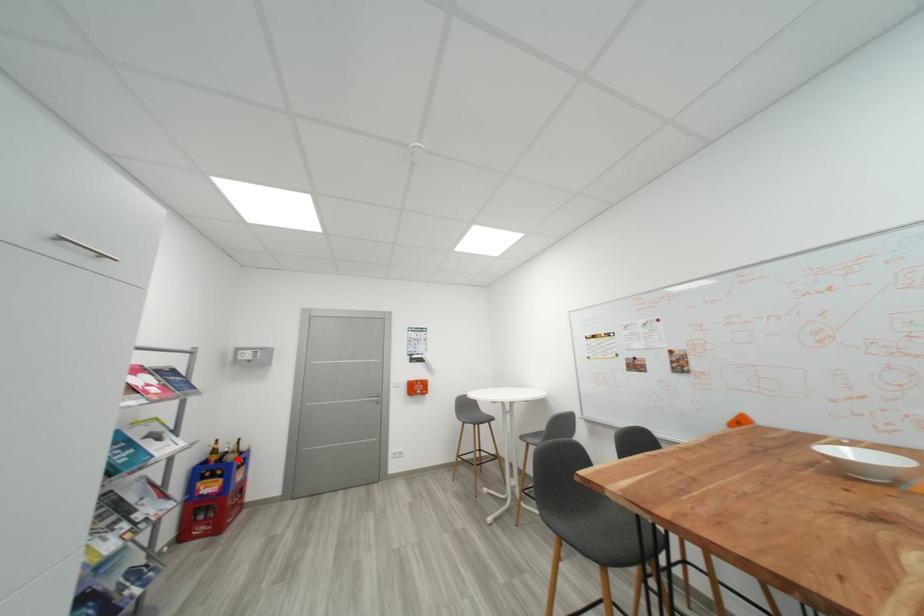
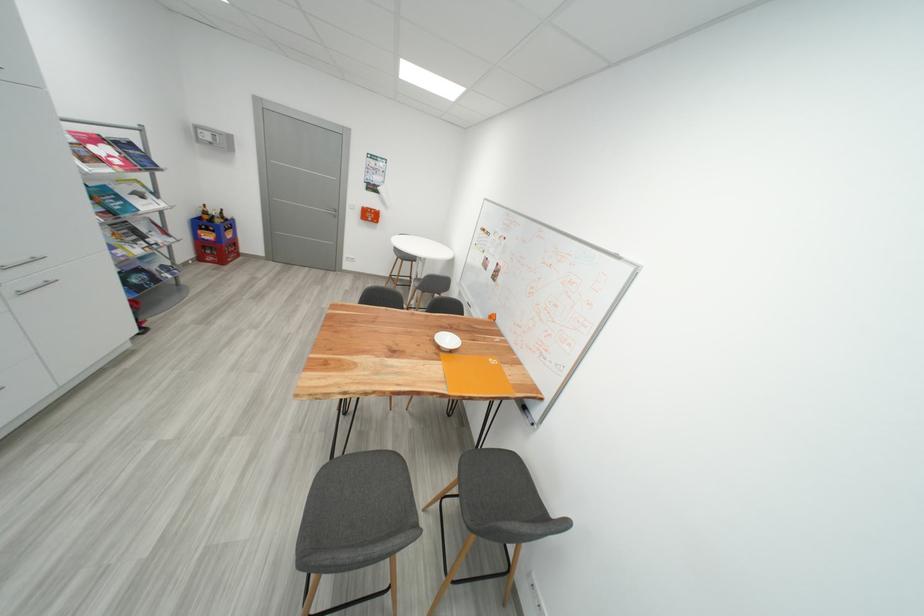
The point at the highlighted location is marked in the first image. Where is the corresponding point in the second image?

(225, 223)